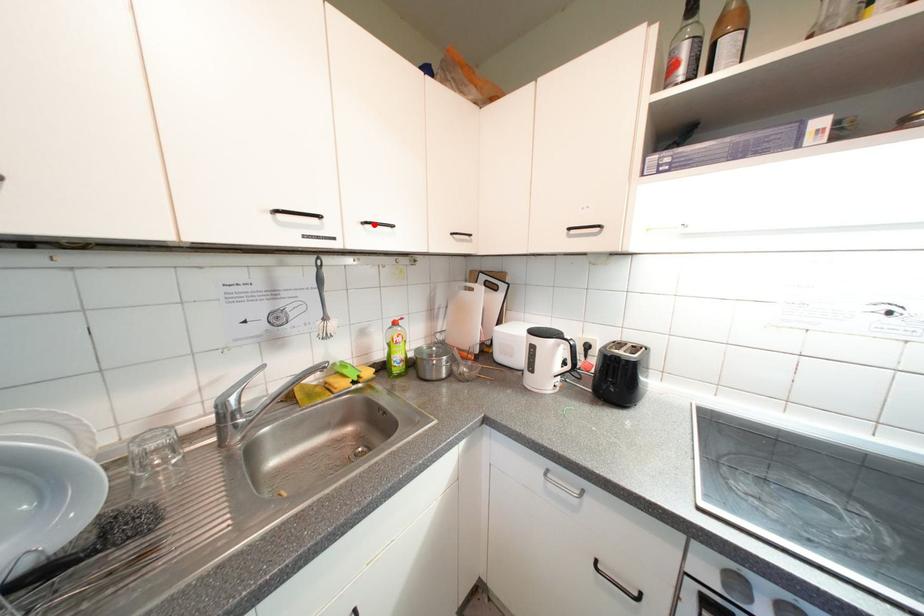
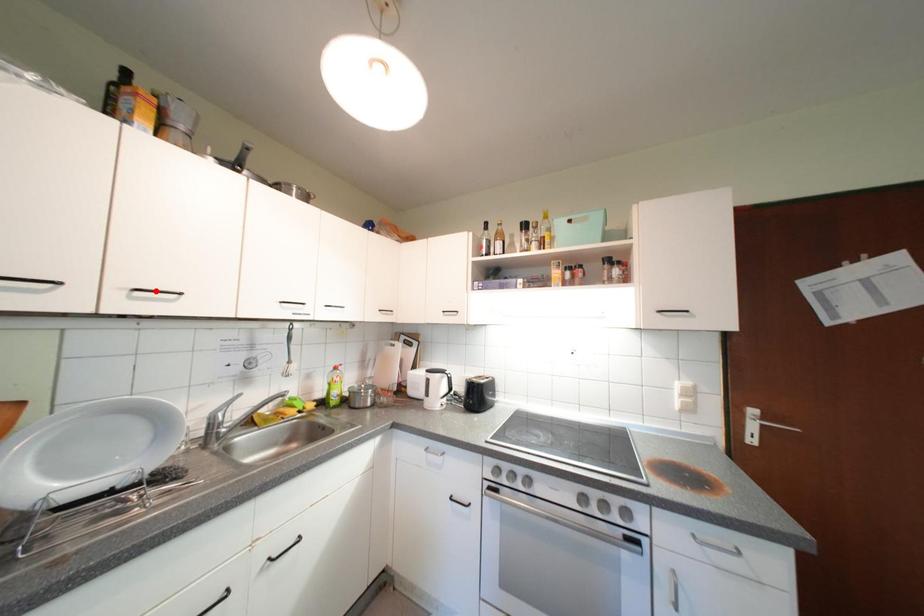
I am providing you with two images of the same scene from different viewpoints. A red point is marked on the first image and another point is marked on the second image. Does the point marked in image1 correspond to the same location as the one in image2?

No